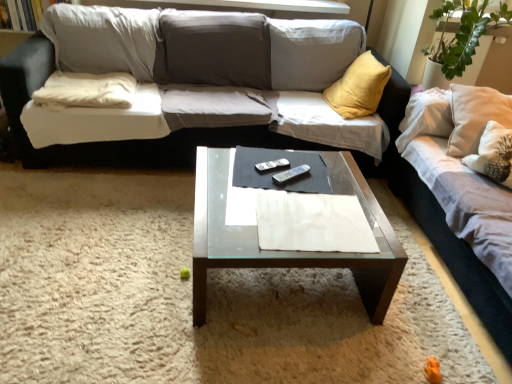
In order to click on free space to the back side of silver metallic remote at center, marked as the 1th remote in a top-to-bottom arrangement in this screenshot , I will do `click(276, 153)`.